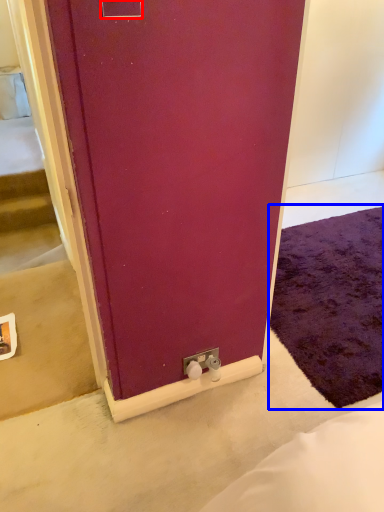
Question: Which object appears farthest to the camera in this image, electric outlet (highlighted by a red box) or doormat (highlighted by a blue box)?

Choices:
 (A) electric outlet
 (B) doormat

Answer: (B)